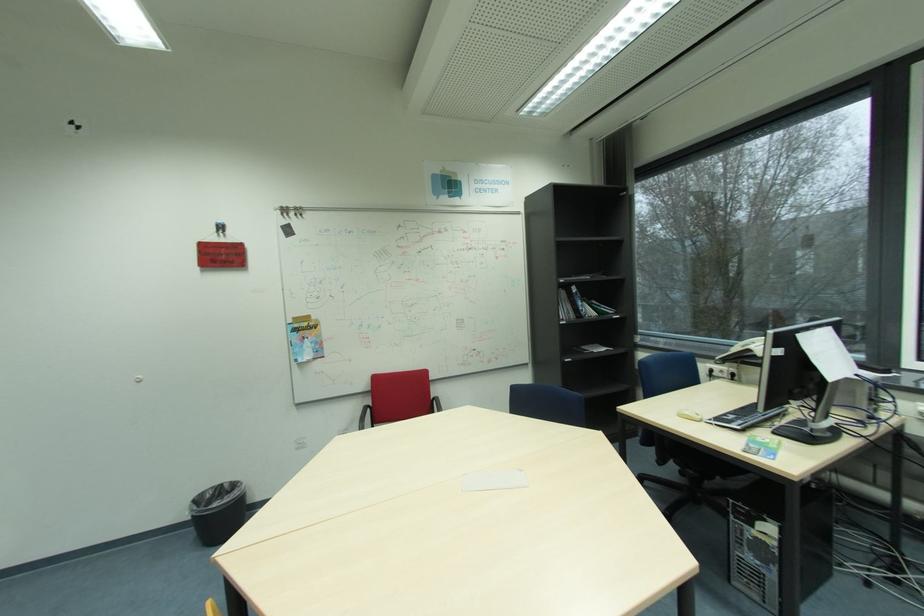
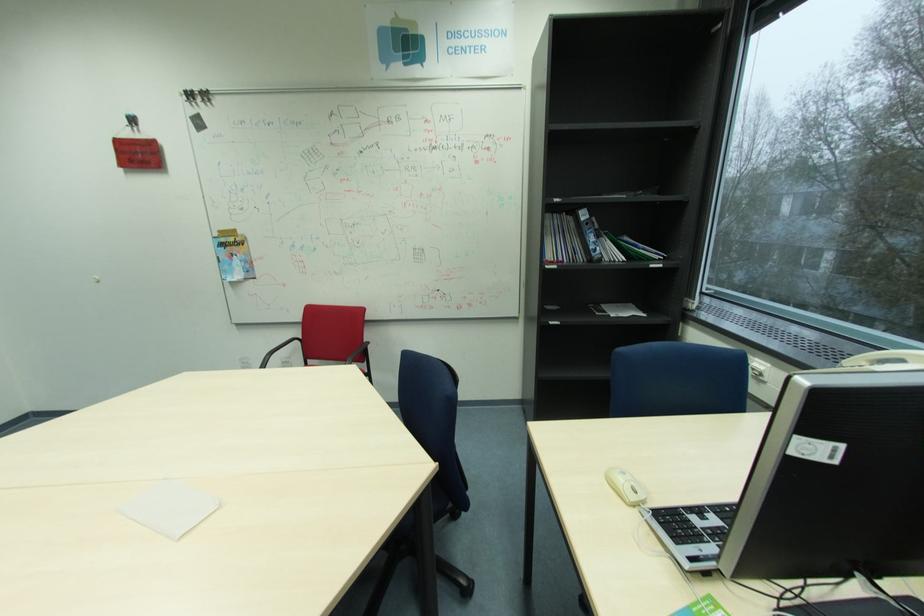
In the scene shown: Which direction would the cameraman need to move to produce the second image?

The cameraman moved toward right, forward.